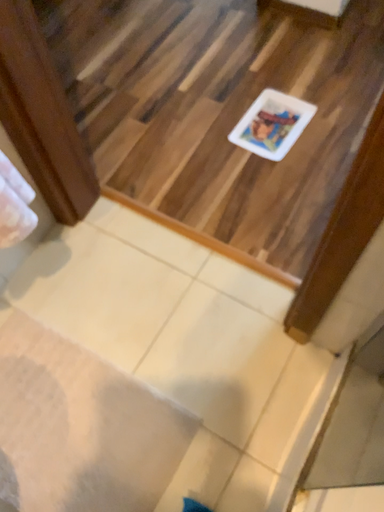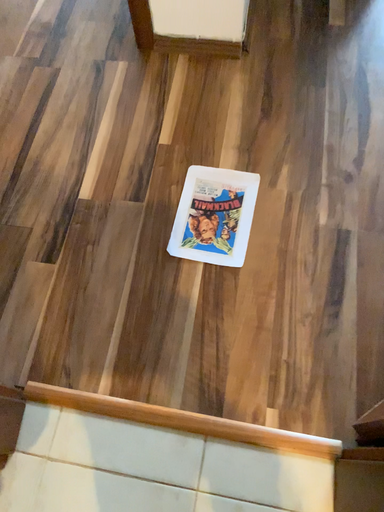
Question: How did the camera likely rotate when shooting the video?

Choices:
 (A) rotated right
 (B) rotated left

Answer: (A)